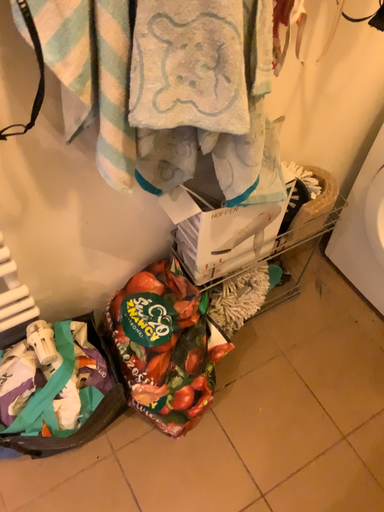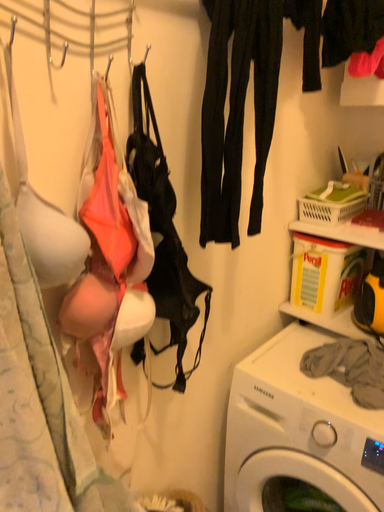
Question: How did the camera likely rotate when shooting the video?

Choices:
 (A) rotated downward
 (B) rotated upward

Answer: (B)